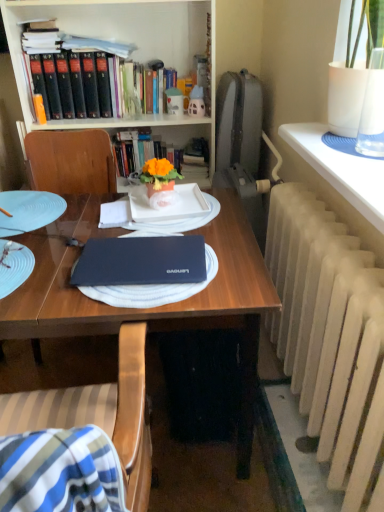
Question: Is orange matte flower pot at center taller than white painted radiator at right?

Choices:
 (A) yes
 (B) no

Answer: (B)

Question: Could you tell me if orange matte flower pot at center is turned towards white painted radiator at right?

Choices:
 (A) no
 (B) yes

Answer: (A)

Question: Is orange matte flower pot at center positioned behind white painted radiator at right?

Choices:
 (A) yes
 (B) no

Answer: (A)

Question: Can you confirm if orange matte flower pot at center is positioned to the right of white painted radiator at right?

Choices:
 (A) yes
 (B) no

Answer: (B)

Question: Is orange matte flower pot at center turned away from white painted radiator at right?

Choices:
 (A) yes
 (B) no

Answer: (B)

Question: Is wooden chair at center taller or shorter than white painted radiator at right?

Choices:
 (A) short
 (B) tall

Answer: (B)

Question: Based on their sizes in the image, would you say wooden chair at center is bigger or smaller than white painted radiator at right?

Choices:
 (A) big
 (B) small

Answer: (A)

Question: Would you say wooden chair at center is to the left or to the right of white painted radiator at right in the picture?

Choices:
 (A) right
 (B) left

Answer: (B)

Question: From a real-world perspective, is wooden chair at center positioned above or below white painted radiator at right?

Choices:
 (A) above
 (B) below

Answer: (B)

Question: Considering the positions of matte black laptop at center and white textured radiator at right, the 1th table when ordered from right to left, in the image, is matte black laptop at center wider or thinner than white textured radiator at right, the 1th table when ordered from right to left,?

Choices:
 (A) thin
 (B) wide

Answer: (B)

Question: Considering the positions of matte black laptop at center and white textured radiator at right, the 1th table positioned from the front, in the image, is matte black laptop at center bigger or smaller than white textured radiator at right, the 1th table positioned from the front,?

Choices:
 (A) big
 (B) small

Answer: (A)

Question: Is matte black laptop at center taller or shorter than white textured radiator at right, which ranks as the second table in back-to-front order?

Choices:
 (A) short
 (B) tall

Answer: (B)

Question: Which is correct: matte black laptop at center is inside white textured radiator at right, the 1th table positioned from the front, or outside of it?

Choices:
 (A) inside
 (B) outside

Answer: (B)

Question: Is white textured radiator at right, which is counted as the 2th table, starting from the left, in front of or behind white matte plate at center in the image?

Choices:
 (A) front
 (B) behind

Answer: (A)

Question: Does point (367, 177) appear closer or farther from the camera than point (140, 223)?

Choices:
 (A) closer
 (B) farther

Answer: (A)